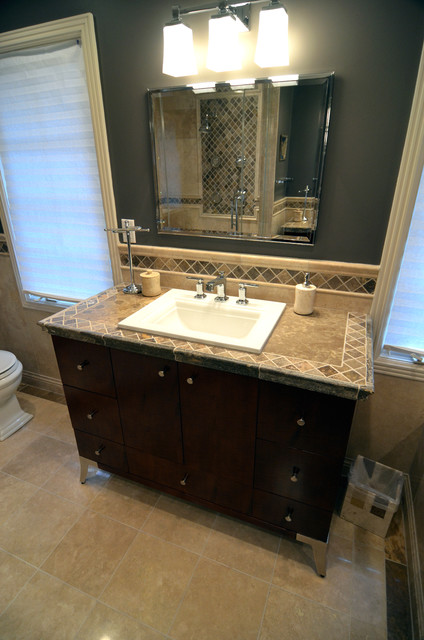
You are a GUI agent. You are given a task and a screenshot of the screen. Output one action in this format:
    pyautogui.click(x=<x>, y=<y>)
    Task: Click on the soap dispenser
    This screenshot has height=640, width=424.
    Given the screenshot: What is the action you would take?
    pyautogui.click(x=309, y=292)